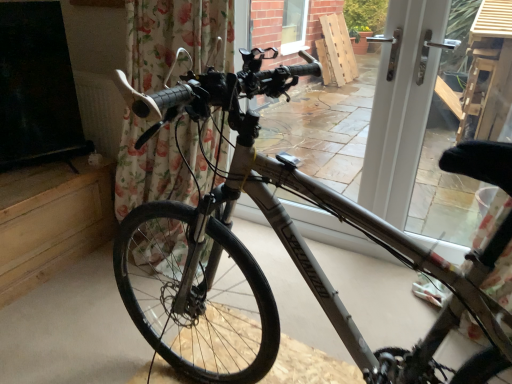
Question: Is white plastic door at center shorter than floral fabric curtain at left?

Choices:
 (A) no
 (B) yes

Answer: (B)

Question: From the image's perspective, is white plastic door at center over floral fabric curtain at left?

Choices:
 (A) yes
 (B) no

Answer: (A)

Question: Does white plastic door at center have a smaller size compared to floral fabric curtain at left?

Choices:
 (A) no
 (B) yes

Answer: (B)

Question: Is white plastic door at center at the right side of floral fabric curtain at left?

Choices:
 (A) yes
 (B) no

Answer: (A)

Question: Is floral fabric curtain at left at the back of white plastic door at center?

Choices:
 (A) yes
 (B) no

Answer: (B)

Question: Is silver metallic bicycle at center wider or thinner than white plastic door at center?

Choices:
 (A) thin
 (B) wide

Answer: (B)

Question: In the image, is silver metallic bicycle at center positioned in front of or behind white plastic door at center?

Choices:
 (A) behind
 (B) front

Answer: (B)

Question: Considering the relative positions of silver metallic bicycle at center and white plastic door at center in the image provided, is silver metallic bicycle at center to the left or to the right of white plastic door at center?

Choices:
 (A) left
 (B) right

Answer: (A)

Question: Is silver metallic bicycle at center spatially inside white plastic door at center, or outside of it?

Choices:
 (A) inside
 (B) outside

Answer: (B)

Question: Considering their positions, is silver metallic bicycle at center located in front of or behind floral fabric curtain at left?

Choices:
 (A) front
 (B) behind

Answer: (A)

Question: Visually, is silver metallic bicycle at center positioned to the left or to the right of floral fabric curtain at left?

Choices:
 (A) left
 (B) right

Answer: (B)

Question: In terms of height, does silver metallic bicycle at center look taller or shorter compared to floral fabric curtain at left?

Choices:
 (A) tall
 (B) short

Answer: (B)

Question: Which is correct: silver metallic bicycle at center is inside floral fabric curtain at left, or outside of it?

Choices:
 (A) outside
 (B) inside

Answer: (A)

Question: In terms of height, does floral fabric curtain at left look taller or shorter compared to silver metallic bicycle at center?

Choices:
 (A) tall
 (B) short

Answer: (A)

Question: Is floral fabric curtain at left to the left or to the right of silver metallic bicycle at center in the image?

Choices:
 (A) right
 (B) left

Answer: (B)